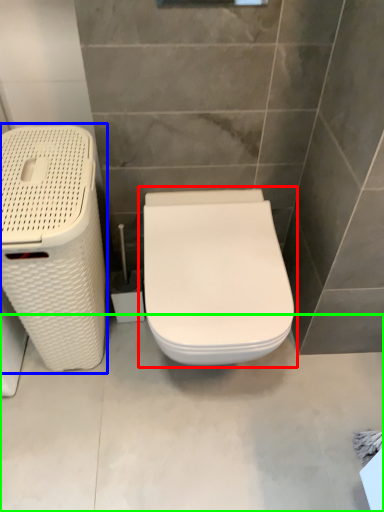
Question: Based on their relative distances, which object is farther from toilet (highlighted by a red box)? Choose from laundry basket (highlighted by a blue box) and concrete (highlighted by a green box).

Choices:
 (A) laundry basket
 (B) concrete

Answer: (B)